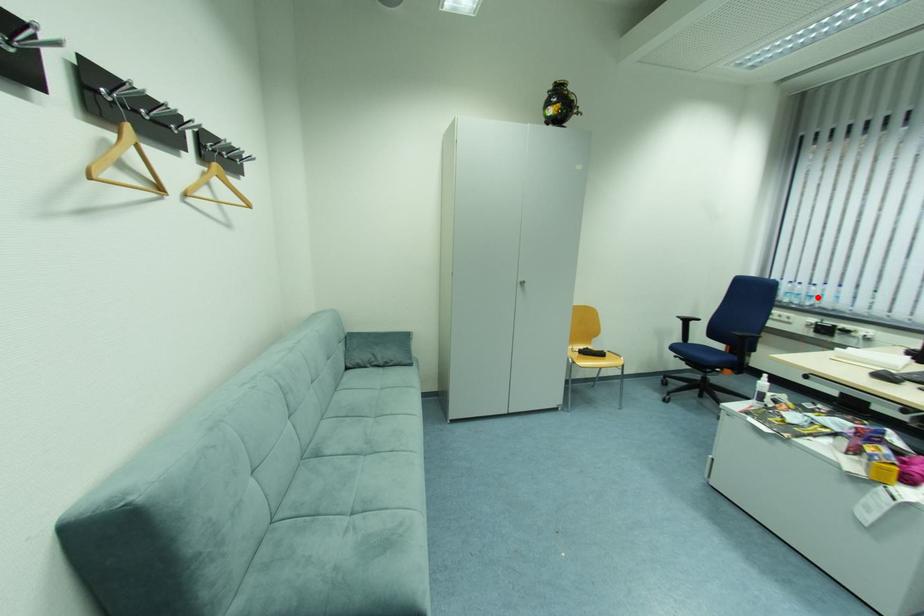
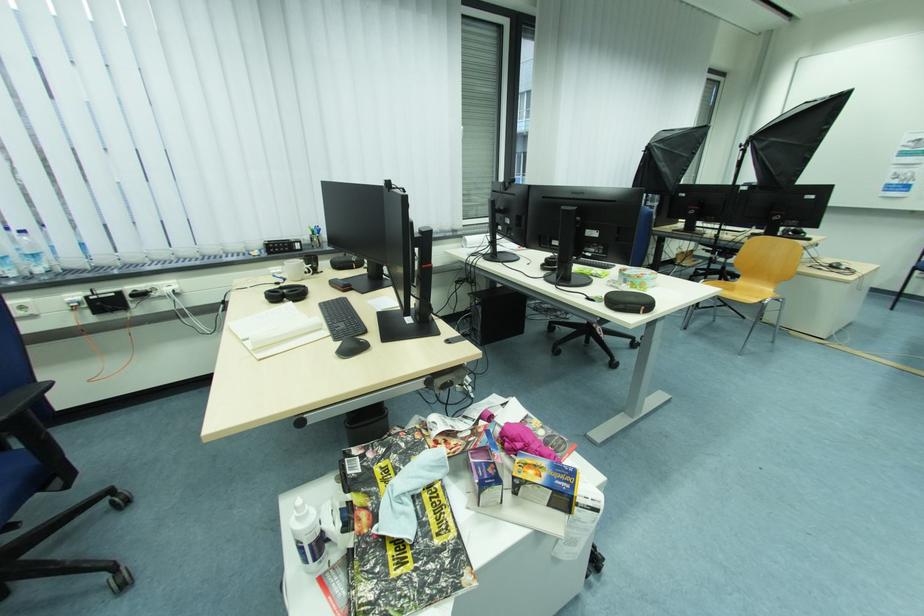
Locate, in the second image, the point that corresponds to the highlighted location in the first image.

(43, 257)